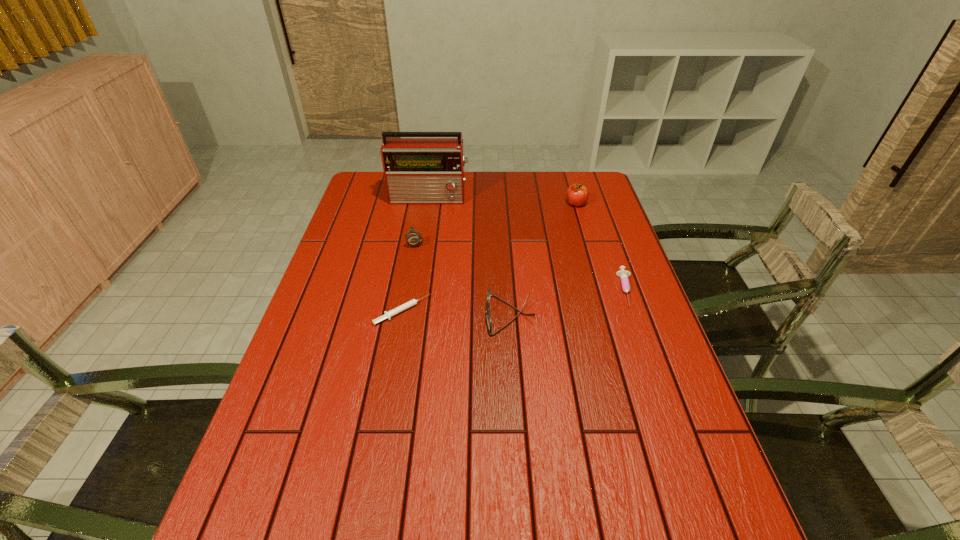
The width and height of the screenshot is (960, 540). I want to click on vacant region between the left syringe and the taller syringe, so click(x=515, y=300).

Identify the location of free space between the compass and the fifth object from left to right. (495, 222).

Image resolution: width=960 pixels, height=540 pixels. In order to click on free point between the third object from right to left and the taller syringe in this screenshot , I will do `click(568, 302)`.

At what (x,y) coordinates should I click in order to perform the action: click on unoccupied position between the third object from right to left and the third farthest object. Please return your answer as a coordinate pair (x, y). The height and width of the screenshot is (540, 960). Looking at the image, I should click on (463, 278).

Where is `empty space between the shortest object and the taller syringe`? The image size is (960, 540). empty space between the shortest object and the taller syringe is located at coordinates (515, 300).

Where is `free space between the fourth nearest object and the left syringe`? This screenshot has height=540, width=960. free space between the fourth nearest object and the left syringe is located at coordinates (409, 276).

At what (x,y) coordinates should I click in order to perform the action: click on vacant space in between the compass and the shortest object. Please return your answer as a coordinate pair (x, y). This screenshot has width=960, height=540. Looking at the image, I should click on (409, 276).

You are a GUI agent. You are given a task and a screenshot of the screen. Output one action in this format:
    pyautogui.click(x=<x>, y=<y>)
    Task: Click on the vacant point located between the spectacles and the shorter syringe
    The height and width of the screenshot is (540, 960).
    Given the screenshot: What is the action you would take?
    pyautogui.click(x=456, y=313)

You are a GUI agent. You are given a task and a screenshot of the screen. Output one action in this format:
    pyautogui.click(x=<x>, y=<y>)
    Task: Click on the object that can be found as the fifth closest to the second object from right to left
    
    Given the screenshot: What is the action you would take?
    pyautogui.click(x=391, y=313)

Find the location of a particular element. This screenshot has height=540, width=960. object that is the closest to the apple is located at coordinates (623, 274).